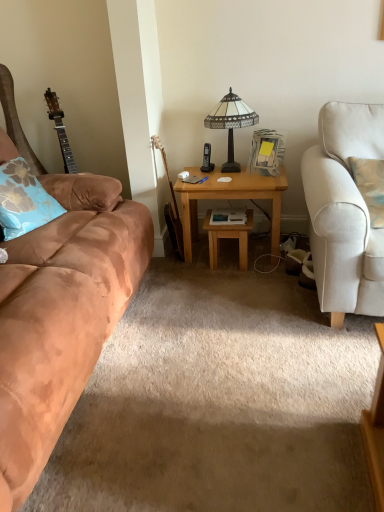
You are a GUI agent. You are given a task and a screenshot of the screen. Output one action in this format:
    pyautogui.click(x=<x>, y=<y>)
    Task: Click on the free point below wooden acoustic guitar at center (from a real-world perspective)
    
    Given the screenshot: What is the action you would take?
    pyautogui.click(x=181, y=258)